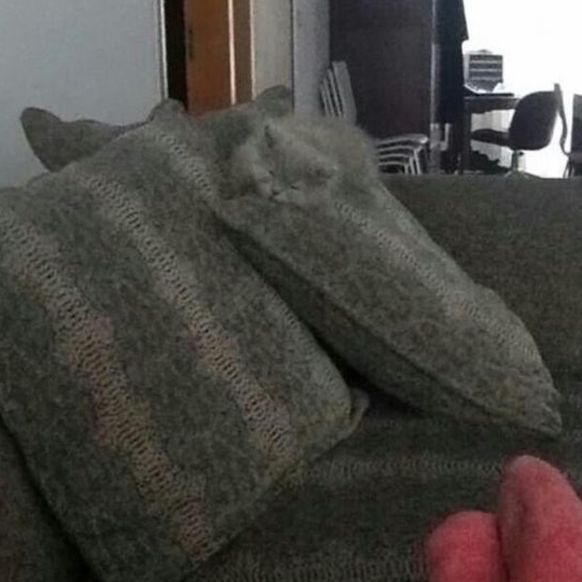
You are a GUI agent. You are given a task and a screenshot of the screen. Output one action in this format:
    pyautogui.click(x=<x>, y=<y>)
    Task: Click on the window
    
    Given the screenshot: What is the action you would take?
    pyautogui.click(x=540, y=51)